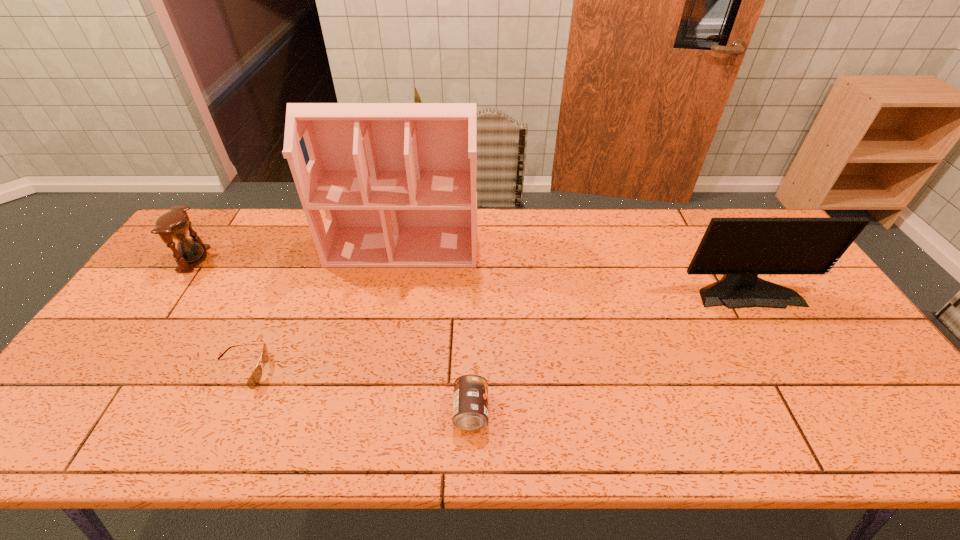
Identify the location of vacant point at the left edge. (118, 352).

This screenshot has height=540, width=960. I want to click on vacant region at the near left corner of the desktop, so click(60, 420).

I want to click on vacant space that is in between the hourglass and the dollhouse, so [x=299, y=252].

Image resolution: width=960 pixels, height=540 pixels. I want to click on empty space that is in between the second tallest object and the fourth object from right to left, so click(492, 330).

Where is `free spot between the leftmost object and the monitor`? Image resolution: width=960 pixels, height=540 pixels. free spot between the leftmost object and the monitor is located at coordinates pyautogui.click(x=469, y=273).

Locate an element on the screen. This screenshot has width=960, height=540. vacant area that lies between the dollhouse and the sunglasses is located at coordinates (322, 309).

Where is `free spot between the second shortest object and the monitor`? The width and height of the screenshot is (960, 540). free spot between the second shortest object and the monitor is located at coordinates (608, 349).

What are the coordinates of `free spot between the can and the second object from left to right` in the screenshot? It's located at (355, 392).

This screenshot has height=540, width=960. What are the coordinates of `unoccupied position between the dollhouse and the fourth tallest object` in the screenshot? It's located at (437, 328).

At what (x,y) coordinates should I click in order to perform the action: click on empty space between the tallest object and the shortest object. Please return your answer as a coordinate pair (x, y). The width and height of the screenshot is (960, 540). Looking at the image, I should click on (322, 309).